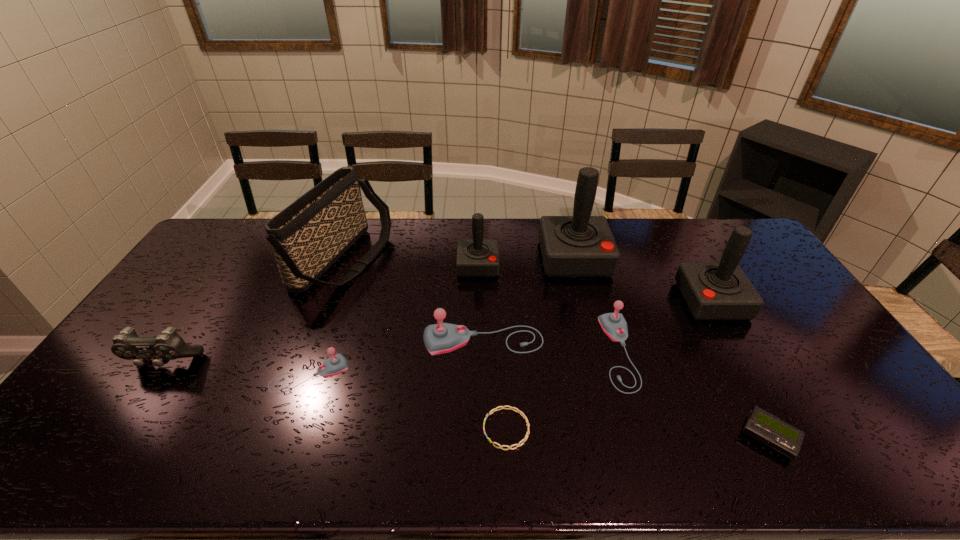
You are a GUI agent. You are given a task and a screenshot of the screen. Output one action in this format:
    pyautogui.click(x=<x>, y=<y>)
    Task: Click on the empty space between the rightmost gray joystick and the ninth tallest object
    Image resolution: width=960 pixels, height=540 pixels.
    Given the screenshot: What is the action you would take?
    pyautogui.click(x=694, y=394)

This screenshot has height=540, width=960. What are the coordinates of `vacant region between the fifth tallest joystick and the third shortest object` in the screenshot? It's located at (465, 363).

You are a GUI agent. You are given a task and a screenshot of the screen. Output one action in this format:
    pyautogui.click(x=<x>, y=<y>)
    Task: Click on the vacant area that lies between the second shortest object and the blue bracelet
    Image resolution: width=960 pixels, height=540 pixels.
    Given the screenshot: What is the action you would take?
    pyautogui.click(x=637, y=433)

The image size is (960, 540). I want to click on unoccupied area between the leftmost object and the seventh shortest object, so click(x=321, y=314).

Locate an element on the screen. This screenshot has width=960, height=540. free point between the control and the biggest gray joystick is located at coordinates (324, 352).

You are a GUI agent. You are given a task and a screenshot of the screen. Output one action in this format:
    pyautogui.click(x=<x>, y=<y>)
    Task: Click on the vacant space that's between the tallest object and the control
    
    Given the screenshot: What is the action you would take?
    pyautogui.click(x=370, y=310)

You are a GUI agent. You are given a task and a screenshot of the screen. Output one action in this format:
    pyautogui.click(x=<x>, y=<y>)
    Task: Click on the free space between the handbag and the bracelet
    Image resolution: width=960 pixels, height=540 pixels.
    Given the screenshot: What is the action you would take?
    pyautogui.click(x=425, y=345)

Find the location of a particular element. This screenshot has width=960, height=540. empty space that is in between the leftmost red joystick and the second shortest object is located at coordinates (624, 351).

The height and width of the screenshot is (540, 960). Identify the location of blank region between the bracelet and the beeper. (637, 433).

Choose which object is the second nearest neighbor to the handbag. Please provide its 2D coordinates. Your answer should be formatted as a tuple, i.e. [(x, y)], where the tuple contains the x and y coordinates of a point satisfying the conditions above.

[(336, 364)]